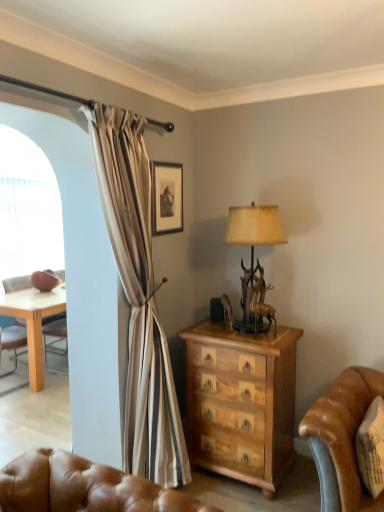
Question: From a real-world perspective, is transparent plastic screen at left positioned above or below matte black picture frame at upper center?

Choices:
 (A) above
 (B) below

Answer: (B)

Question: Based on their positions, is transparent plastic screen at left located to the left or right of matte black picture frame at upper center?

Choices:
 (A) left
 (B) right

Answer: (A)

Question: Which object is the farthest from the antique brass lamp at center?

Choices:
 (A) matte black picture frame at upper center
 (B) transparent plastic screen at left
 (C) wooden chest of drawers at center

Answer: (B)

Question: Considering the real-world distances, which object is farthest from the transparent plastic screen at left?

Choices:
 (A) wooden chest of drawers at center
 (B) antique brass lamp at center
 (C) matte black picture frame at upper center

Answer: (B)